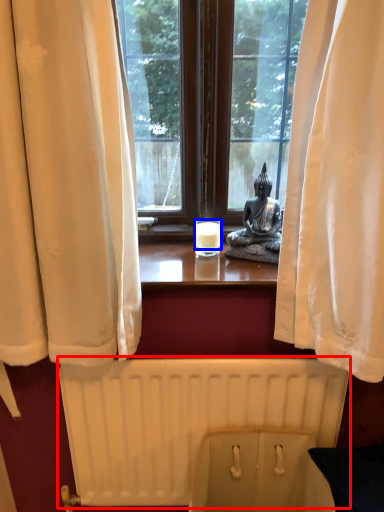
Question: Which object is further to the camera taking this photo, radiator (highlighted by a red box) or candle (highlighted by a blue box)?

Choices:
 (A) radiator
 (B) candle

Answer: (B)